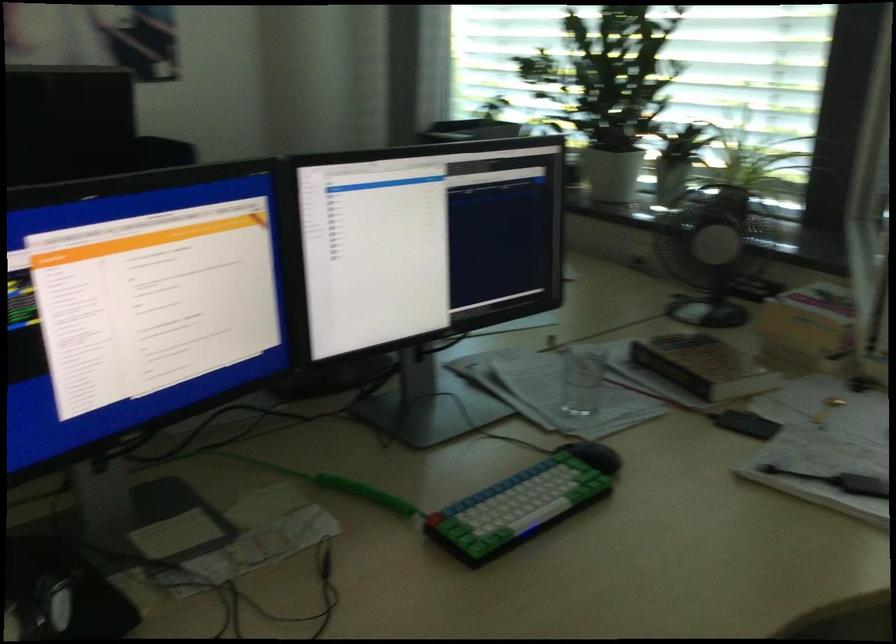
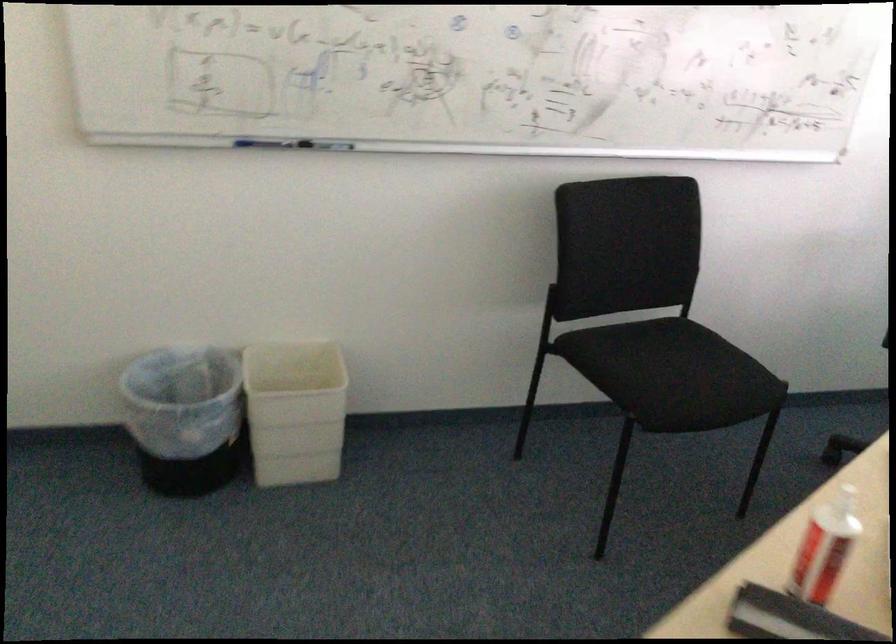
Question: The images are taken continuously from a first-person perspective. In which direction are you moving?

Choices:
 (A) Left
 (B) Right
 (C) Forward
 (D) Backward

Answer: (A)